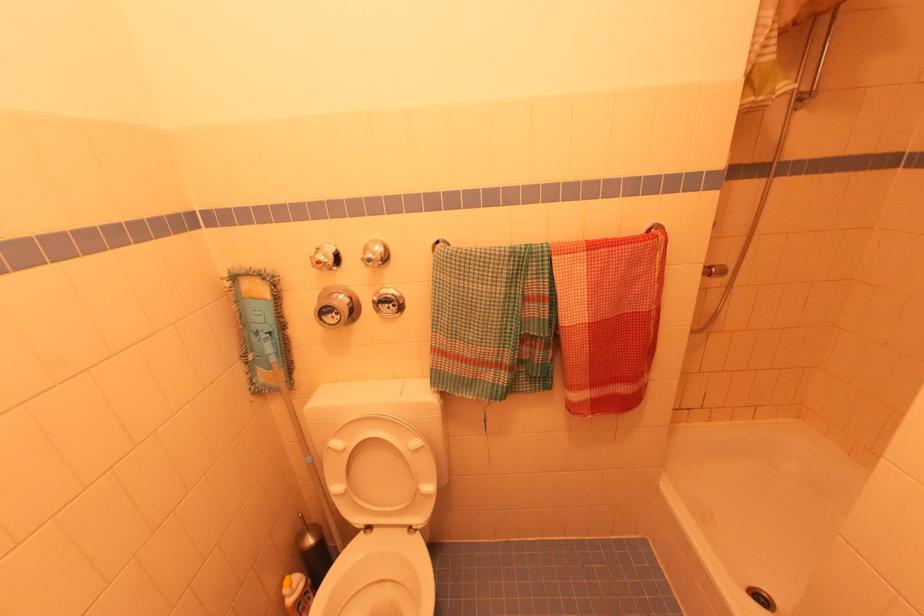
What do you see at coordinates (380, 472) in the screenshot?
I see `a white toilet lid` at bounding box center [380, 472].